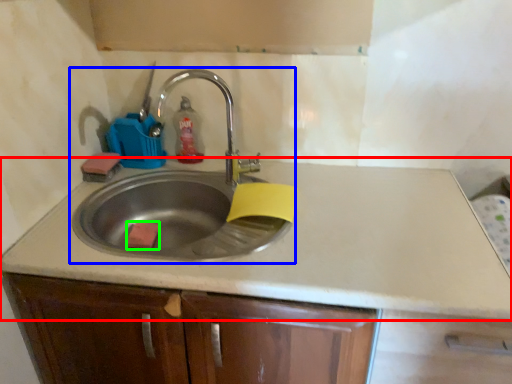
Question: Based on their relative distances, which object is farther from countertop (highlighted by a red box)? Choose from sink (highlighted by a blue box) and soap (highlighted by a green box).

Choices:
 (A) sink
 (B) soap

Answer: (B)